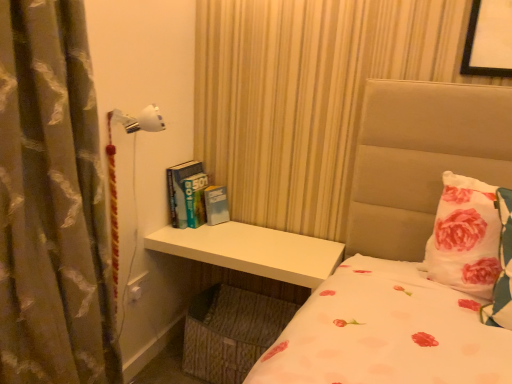
Question: Is hardcover books at center bigger or smaller than white floral pillow at right?

Choices:
 (A) small
 (B) big

Answer: (A)

Question: Relative to white floral pillow at right, is hardcover books at center in front or behind?

Choices:
 (A) front
 (B) behind

Answer: (B)

Question: Which is farther from the white floral pillow at right?

Choices:
 (A) hardcover books at center
 (B) white glossy table at lower center
 (C) silky brown curtain at left

Answer: (C)

Question: Considering the real-world distances, which object is farthest from the hardcover books at center?

Choices:
 (A) silky brown curtain at left
 (B) white floral pillow at right
 (C) white glossy table at lower center

Answer: (B)